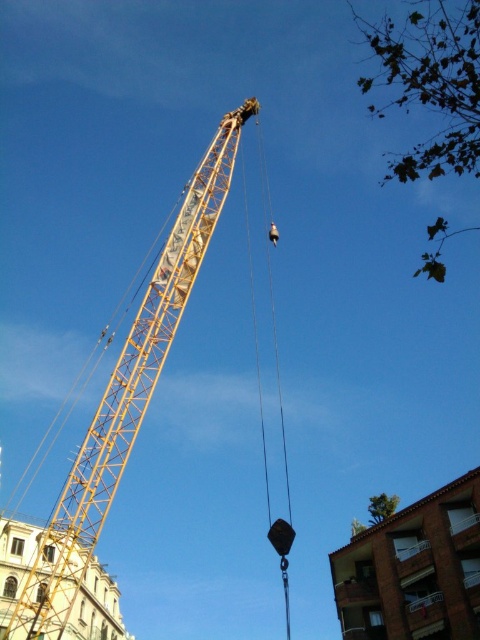
From the picture: You are a construction worker standing at point A with coordinates point A at (163, 285). You need to move to point B which is 112.73 meters away from you. Can you safely walk from point A to point B without any obstacles?

The distance between point A at (163, 285) and point B is 112.73 meters. Since there are no obstacles mentioned in the scene description, you can safely walk from point A to point B.

From the picture: You are an engineer inspecting the construction site. You need to determine the visibility of the crane and the lift. Which object is closer to you between the yellow metallic crane at center and the black rubber lift at center?

The yellow metallic crane at center is in front of the black rubber lift at center, so the yellow metallic crane at center is closer to you.